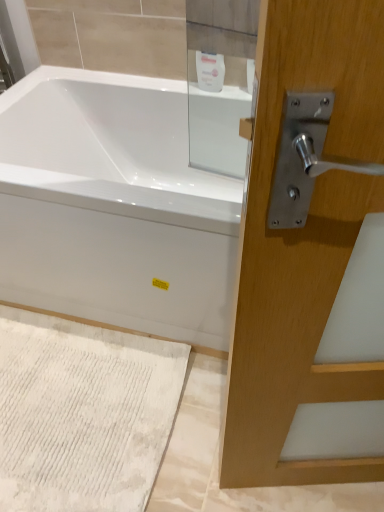
Question: Does white textured bath mat at lower left have a greater width compared to white glossy soap dispenser at upper center?

Choices:
 (A) yes
 (B) no

Answer: (A)

Question: Is white textured bath mat at lower left smaller than white glossy soap dispenser at upper center?

Choices:
 (A) yes
 (B) no

Answer: (B)

Question: Is white textured bath mat at lower left in front of white glossy soap dispenser at upper center?

Choices:
 (A) yes
 (B) no

Answer: (A)

Question: From the image's perspective, does white textured bath mat at lower left appear higher than white glossy soap dispenser at upper center?

Choices:
 (A) yes
 (B) no

Answer: (B)

Question: From a real-world perspective, is white textured bath mat at lower left on white glossy soap dispenser at upper center?

Choices:
 (A) yes
 (B) no

Answer: (B)

Question: From the image's perspective, is white glossy soap dispenser at upper center positioned above or below white textured bath mat at lower left?

Choices:
 (A) above
 (B) below

Answer: (A)

Question: Is white glossy soap dispenser at upper center taller or shorter than white textured bath mat at lower left?

Choices:
 (A) tall
 (B) short

Answer: (A)

Question: Which is correct: white glossy soap dispenser at upper center is inside white textured bath mat at lower left, or outside of it?

Choices:
 (A) outside
 (B) inside

Answer: (A)

Question: In the image, is white glossy soap dispenser at upper center positioned in front of or behind white textured bath mat at lower left?

Choices:
 (A) front
 (B) behind

Answer: (B)

Question: From the image's perspective, is white glossy bathtub at center located above or below white glossy soap dispenser at upper center?

Choices:
 (A) below
 (B) above

Answer: (A)

Question: Looking at their shapes, would you say white glossy bathtub at center is wider or thinner than white glossy soap dispenser at upper center?

Choices:
 (A) wide
 (B) thin

Answer: (A)

Question: Would you say white glossy bathtub at center is to the left or to the right of white glossy soap dispenser at upper center in the picture?

Choices:
 (A) left
 (B) right

Answer: (A)

Question: Would you say white glossy bathtub at center is inside or outside white glossy soap dispenser at upper center?

Choices:
 (A) inside
 (B) outside

Answer: (B)

Question: Is white textured bath mat at lower left inside the boundaries of white glossy bathtub at center, or outside?

Choices:
 (A) inside
 (B) outside

Answer: (B)

Question: In the image, is white textured bath mat at lower left on the left side or the right side of white glossy bathtub at center?

Choices:
 (A) right
 (B) left

Answer: (B)